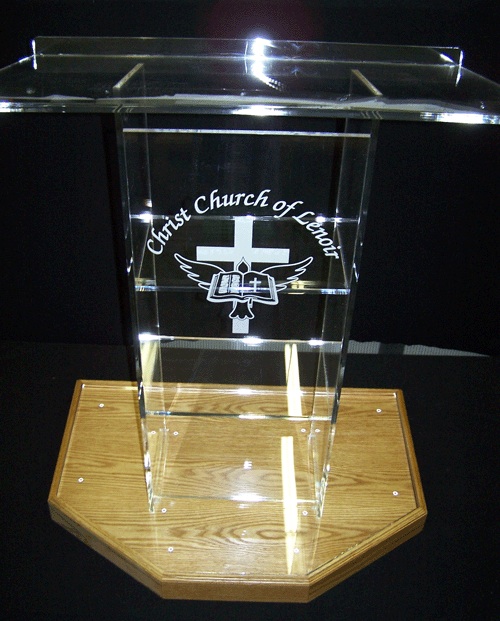
Image resolution: width=500 pixels, height=621 pixels. In order to click on glass in this screenshot , I will do `click(298, 408)`.